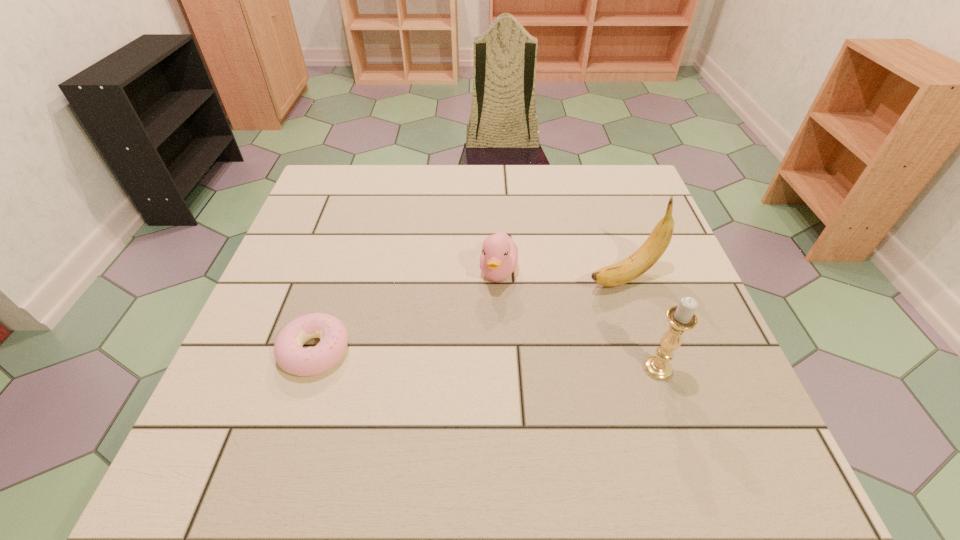
Where is `vacant space located at the start of the peel on the banana`? vacant space located at the start of the peel on the banana is located at coordinates (504, 323).

Where is `free location located on the front-facing side of the third object from right to left`? The height and width of the screenshot is (540, 960). free location located on the front-facing side of the third object from right to left is located at coordinates [492, 333].

Find the location of a particular element. The height and width of the screenshot is (540, 960). free location located on the front-facing side of the third object from right to left is located at coordinates (483, 398).

Identify the location of free space located 0.280m on the front-facing side of the third object from right to left. (482, 408).

The image size is (960, 540). What are the coordinates of `object positioned at the left edge` in the screenshot? It's located at 289,353.

At what (x,y) coordinates should I click in order to perform the action: click on candle holder at the right edge. Please return your answer as a coordinate pair (x, y). Looking at the image, I should click on (681, 318).

Find the location of a particular element. banana at the right edge is located at coordinates (638, 263).

In the image, there is a desktop. At what (x,y) coordinates should I click in order to perform the action: click on vacant space at the far edge. Please return your answer as a coordinate pair (x, y). The image size is (960, 540). Looking at the image, I should click on (385, 165).

The image size is (960, 540). In the image, there is a desktop. In order to click on vacant space at the near edge in this screenshot , I will do `click(454, 407)`.

In the image, there is a desktop. In order to click on free space at the left edge in this screenshot , I will do `click(324, 219)`.